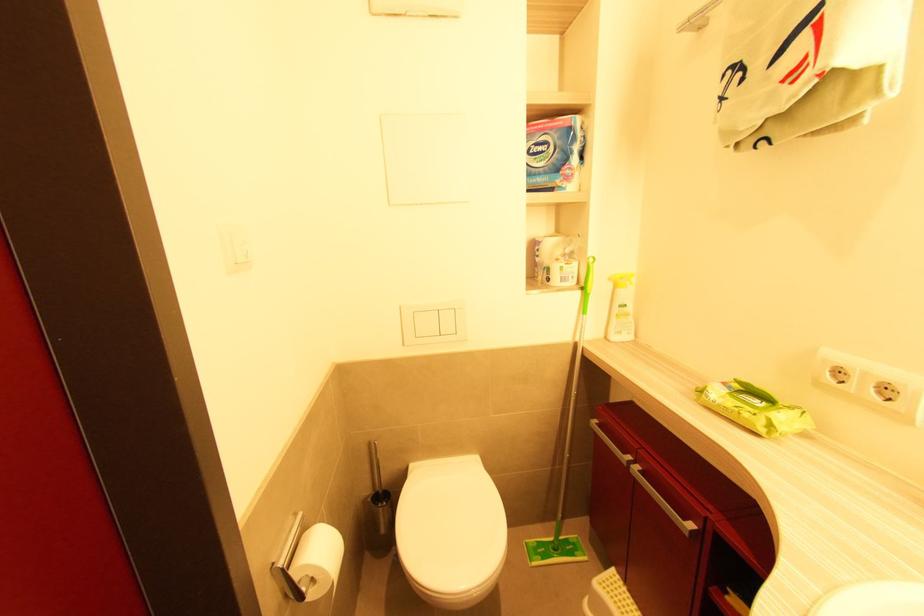
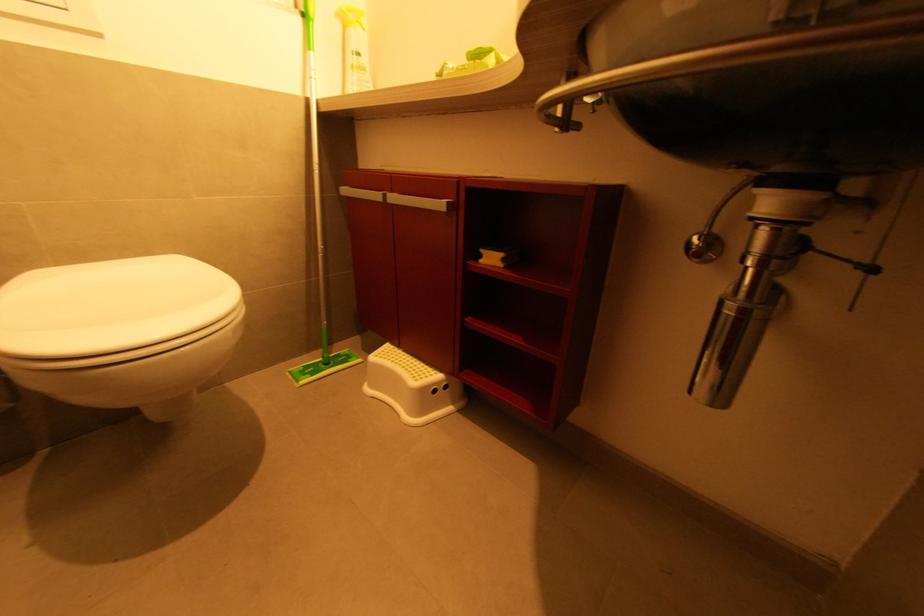
Question: The camera is either moving clockwise (left) or counter-clockwise (right) around the object. The first image is from the beginning of the video and the second image is from the end. Is the camera moving left or right when shooting the video?

Choices:
 (A) Left
 (B) Right

Answer: (A)